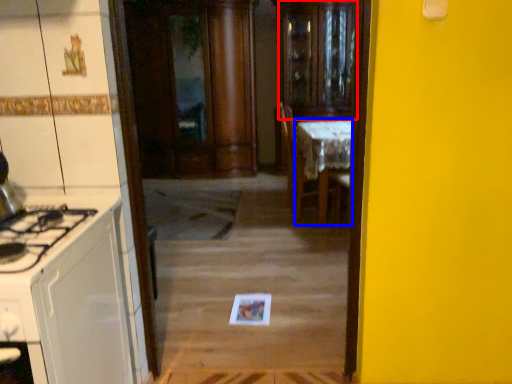
Question: Among these objects, which one is nearest to the camera, glass door (highlighted by a red box) or table (highlighted by a blue box)?

Choices:
 (A) glass door
 (B) table

Answer: (B)